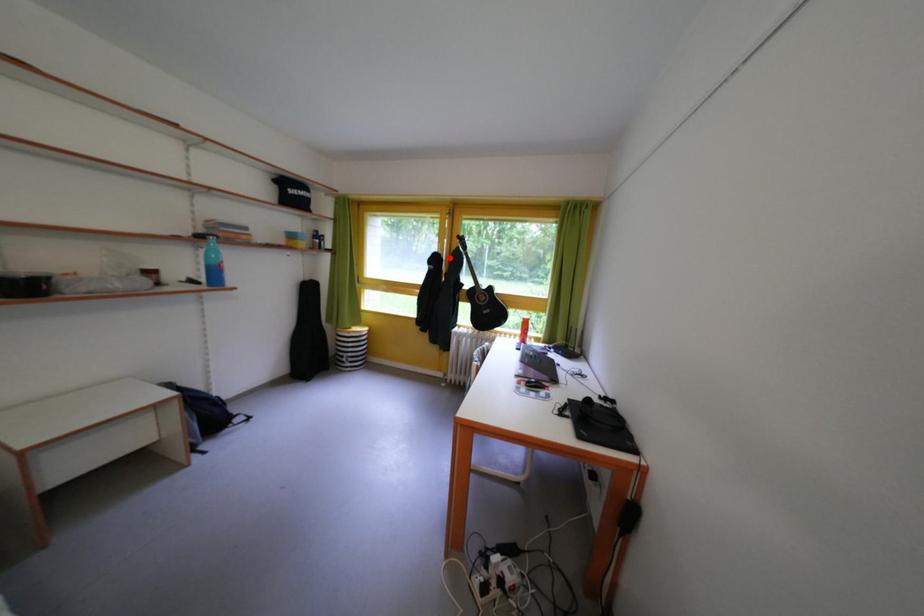
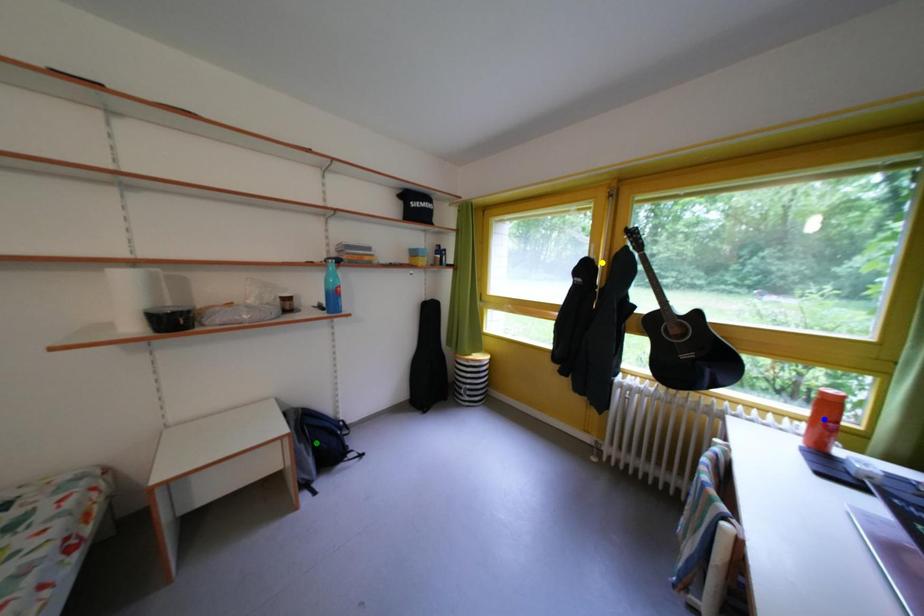
Question: I am providing you with two images of the same scene from different viewpoints. A red point is marked on the first image. You are given multiple points on the second image. Which point in image 2 is actually the same real-world point as the red point in image 1?

Choices:
 (A) green point
 (B) blue point
 (C) yellow point

Answer: (C)